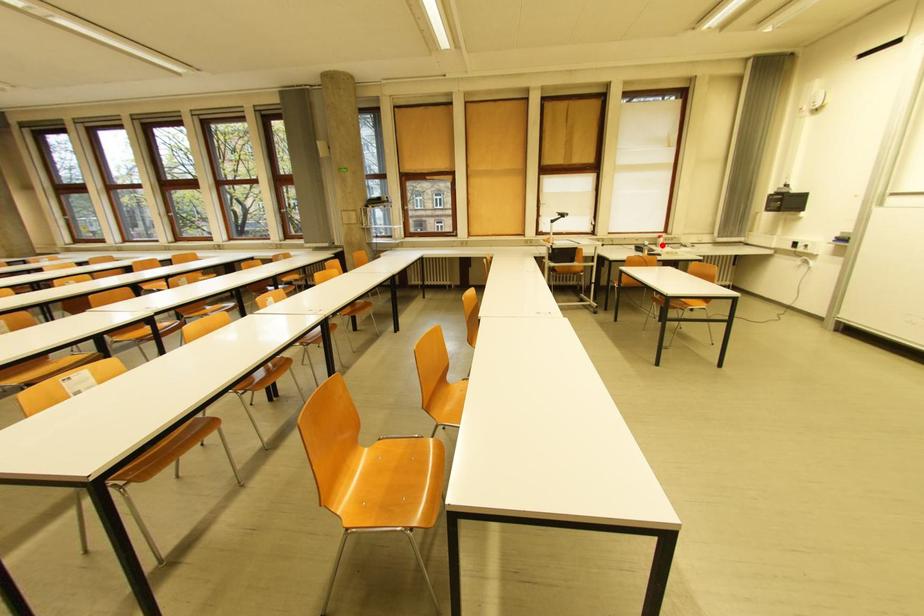
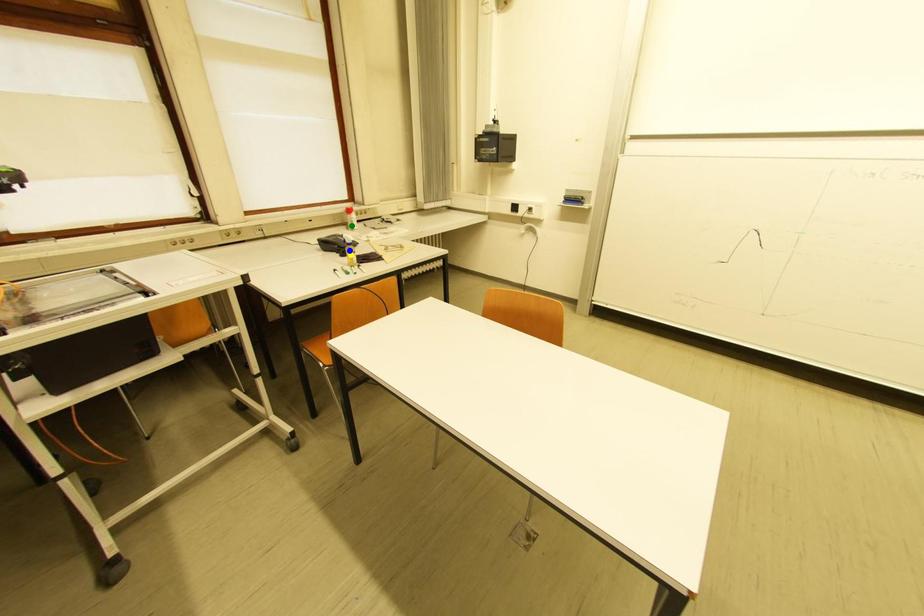
Question: I am providing you with two images of the same scene from different viewpoints. A red point is marked on the first image. You are given multiple points on the second image. Can you choose the point in image 2 that corresponds to the point in image 1?

Choices:
 (A) yellow point
 (B) green point
 (C) blue point

Answer: (B)